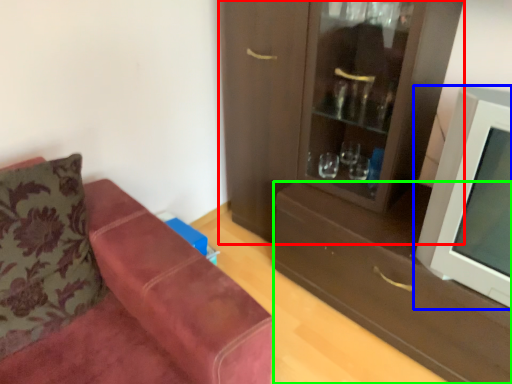
Question: Which object is positioned closest to cabinetry (highlighted by a red box)? Select from television (highlighted by a blue box) and drawer (highlighted by a green box).

Choices:
 (A) television
 (B) drawer

Answer: (B)